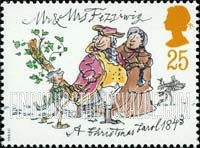
Find the location of `coat`. coat is located at coordinates (90, 66).